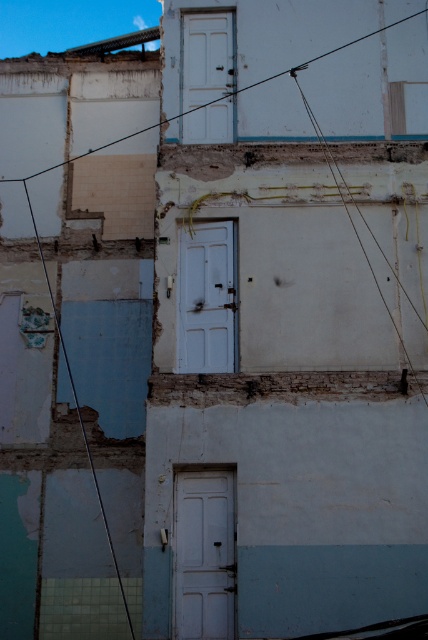
You are a painter assessing the building for a restoration project. You notice the smooth wire at upper center and the rusty wire at right. Which wire is positioned higher up on the building?

The smooth wire at upper center is positioned higher up on the building than the rusty wire at right because it is much taller.